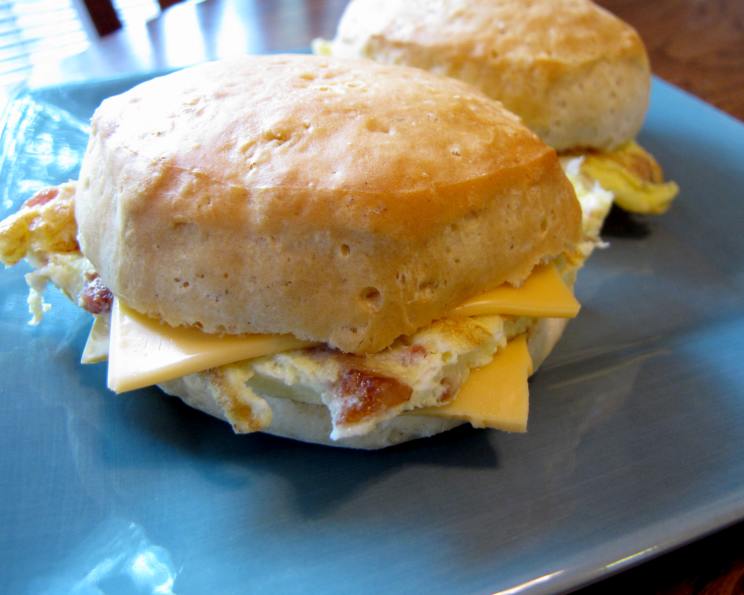
You are a GUI agent. You are given a task and a screenshot of the screen. Output one action in this format:
    pyautogui.click(x=<x>, y=<y>)
    Task: Click on the plate
    
    Given the screenshot: What is the action you would take?
    pyautogui.click(x=646, y=453)